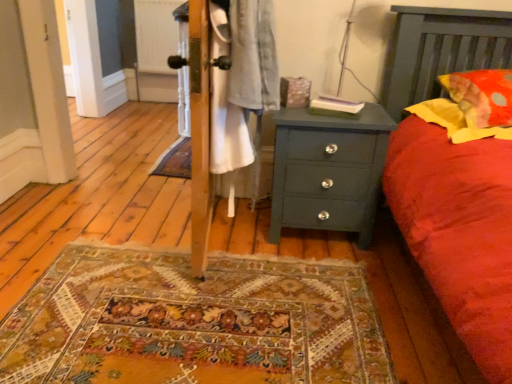
Question: From a real-world perspective, is white wood screen door at left located beneath teal painted wood chest of drawers at center?

Choices:
 (A) no
 (B) yes

Answer: (A)

Question: Considering the relative sizes of white wood screen door at left and teal painted wood chest of drawers at center in the image provided, is white wood screen door at left thinner than teal painted wood chest of drawers at center?

Choices:
 (A) yes
 (B) no

Answer: (A)

Question: Is white wood screen door at left facing towards teal painted wood chest of drawers at center?

Choices:
 (A) yes
 (B) no

Answer: (B)

Question: Considering the relative positions of white wood screen door at left and teal painted wood chest of drawers at center in the image provided, is white wood screen door at left to the left of teal painted wood chest of drawers at center from the viewer's perspective?

Choices:
 (A) yes
 (B) no

Answer: (A)

Question: Is white wood screen door at left taller than teal painted wood chest of drawers at center?

Choices:
 (A) no
 (B) yes

Answer: (B)

Question: Is white wood screen door at left closer to camera compared to teal painted wood chest of drawers at center?

Choices:
 (A) yes
 (B) no

Answer: (B)

Question: Does white wood screen door at left have a greater width compared to yellow fabric pillow at right, which appears as the second pillow when ordered from the bottom?

Choices:
 (A) no
 (B) yes

Answer: (A)

Question: Is white wood screen door at left not near yellow fabric pillow at right, arranged as the first pillow when viewed from the top?

Choices:
 (A) yes
 (B) no

Answer: (A)

Question: Can you confirm if white wood screen door at left is smaller than yellow fabric pillow at right, which appears as the second pillow when ordered from the bottom?

Choices:
 (A) yes
 (B) no

Answer: (B)

Question: Would you say white wood screen door at left is outside yellow fabric pillow at right, arranged as the first pillow when viewed from the top?

Choices:
 (A) yes
 (B) no

Answer: (A)

Question: Is white wood screen door at left touching yellow fabric pillow at right, which appears as the second pillow when ordered from the bottom?

Choices:
 (A) yes
 (B) no

Answer: (B)

Question: Would you say white wood screen door at left contains yellow fabric pillow at right, arranged as the first pillow when viewed from the top?

Choices:
 (A) yes
 (B) no

Answer: (B)

Question: Is soft yellow fabric pillow at right, the second pillow viewed from the top, closer to the viewer compared to teal painted wood chest of drawers at center?

Choices:
 (A) no
 (B) yes

Answer: (B)